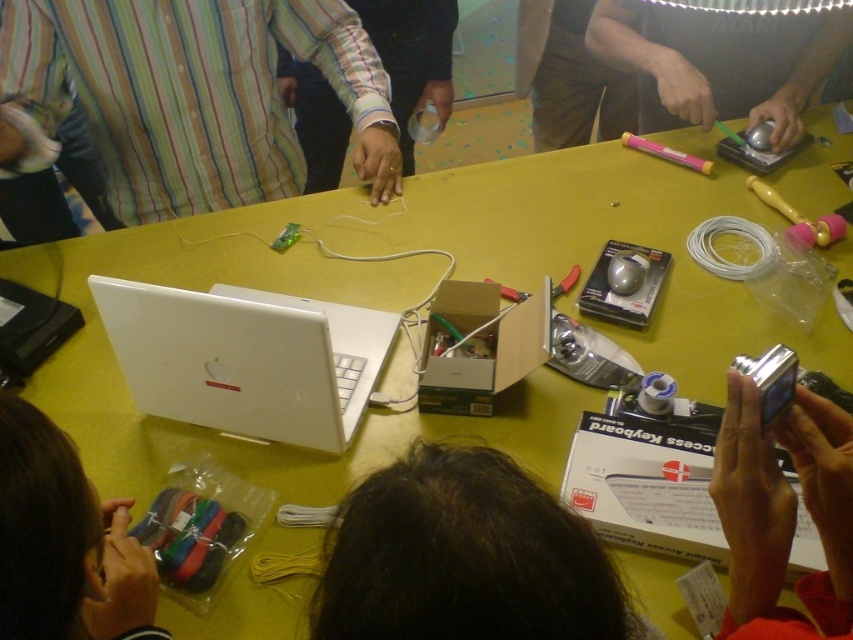
Identify the location of white matte laptop at center. The width and height of the screenshot is (853, 640). (247, 358).

Does white matte laptop at center have a lesser width compared to brown fabric pants at upper center?

No.

Where is `white matte laptop at center`? white matte laptop at center is located at coordinates (247, 358).

The image size is (853, 640). Describe the element at coordinates (782, 513) in the screenshot. I see `metallic silver camera at lower right` at that location.

Measure the distance between point (728, 516) and camera.

75.18 centimeters

Between point (798, 614) and point (398, 29), which one is positioned in front?

Positioned in front is point (798, 614).

You are a GUI agent. You are given a task and a screenshot of the screen. Output one action in this format:
    pyautogui.click(x=<x>, y=<y>)
    Task: Click on the metallic silver camera at lower right
    
    Given the screenshot: What is the action you would take?
    pyautogui.click(x=782, y=513)

Does white matte wristband at center have a greater width compared to brown fabric pants at upper center?

Indeed, white matte wristband at center has a greater width compared to brown fabric pants at upper center.

Does white matte wristband at center have a lesser width compared to brown fabric pants at upper center?

In fact, white matte wristband at center might be wider than brown fabric pants at upper center.

Is point (410, 168) farther from camera compared to point (546, 40)?

Yes, it is behind point (546, 40).

This screenshot has width=853, height=640. Find the location of `white matte wristband at center`. white matte wristband at center is located at coordinates point(412,56).